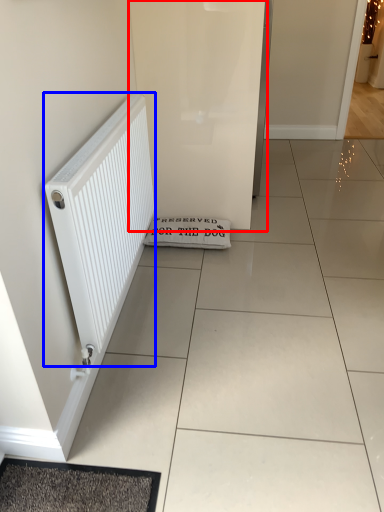
Question: Among these objects, which one is farthest to the camera, screen door (highlighted by a red box) or radiator (highlighted by a blue box)?

Choices:
 (A) screen door
 (B) radiator

Answer: (A)